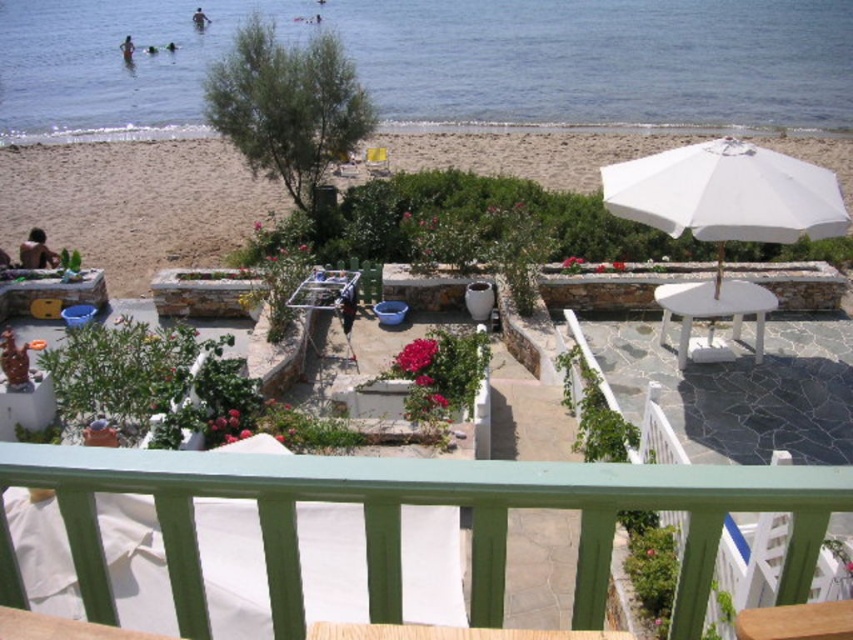
You are standing on the balcony and want to walk to the white sand at upper left. Which direction should you move relative to the green painted wood railing at center?

Since the green painted wood railing at center is to the left of the white sand at upper left, you should move to the left of the green painted wood railing at center to reach the white sand at upper left.

You are standing on a balcony and looking down at the beach scene. You notice the green painted wood railing at center and the white sand at upper left. Which object is taller?

The green painted wood railing at center is not as tall as the white sand at upper left, so the white sand at upper left is taller.

You are sitting on the yellow fabric chair at center and want to know if the white fabric umbrella at right can provide shade over you. Based on their heights, can the umbrella cover you?

The white fabric umbrella at right is not as tall as the yellow fabric chair at center, so the umbrella is shorter. Since the umbrella is shorter, it may not provide sufficient shade over the yellow fabric chair at center unless it is positioned closer or angled appropriately.